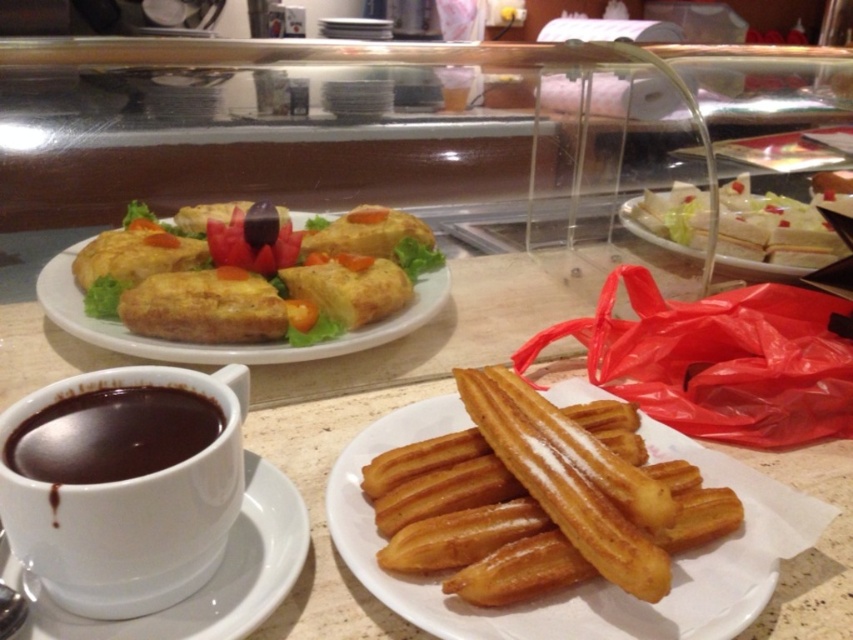
Question: Does golden fried pastry at center come in front of white ceramic saucer at lower left?

Choices:
 (A) no
 (B) yes

Answer: (A)

Question: Which object is closer to the camera taking this photo?

Choices:
 (A) white creamy sandwich at upper right
 (B) satin white plate at center
 (C) white ceramic saucer at lower left

Answer: (C)

Question: Is the position of golden fried churros at center less distant than that of golden fried pastry at center?

Choices:
 (A) no
 (B) yes

Answer: (B)

Question: Does satin white plate at center have a smaller size compared to white ceramic saucer at lower left?

Choices:
 (A) no
 (B) yes

Answer: (A)

Question: Which of the following is the closest to the observer?

Choices:
 (A) white creamy sandwich at upper right
 (B) golden fried pastry at center
 (C) satin white plate at center
 (D) golden fried churros at center

Answer: (D)

Question: Which of the following is the farthest from the observer?

Choices:
 (A) (62, 435)
 (B) (225, 625)

Answer: (A)